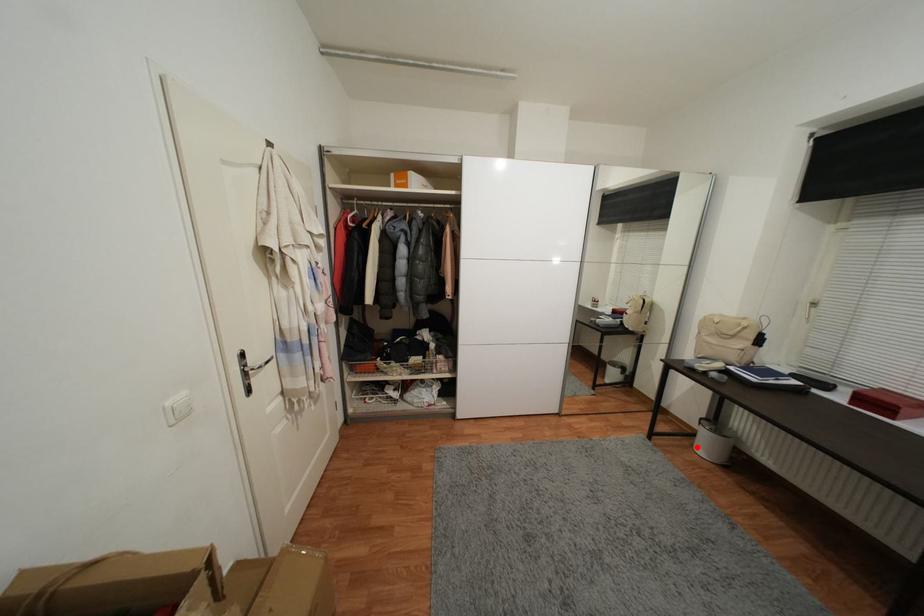
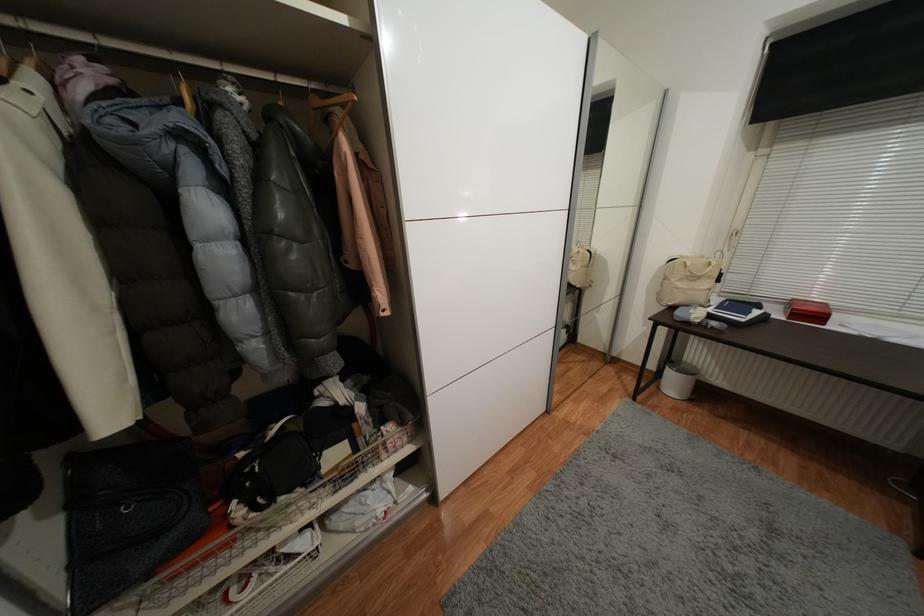
Find the pixel in the second image that matches the highlighted location in the first image.

(663, 390)